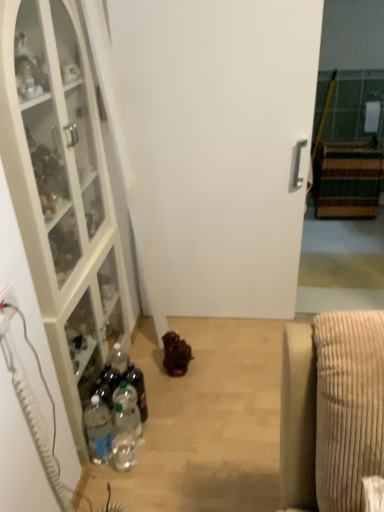
Find the location of a particular element. The width and height of the screenshot is (384, 512). vacant space behind clear plastic bottle at lower left, marked as the second bottle in a right-to-left arrangement is located at coordinates (159, 406).